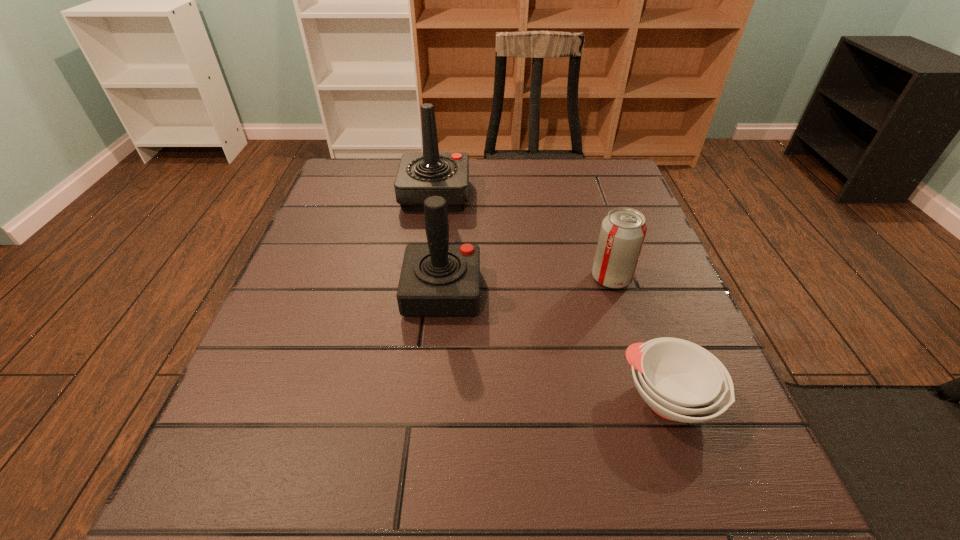
Find the location of a particular element. vacant space that satisfies the following two spatial constraints: 1. on the base of the nearer joystick; 2. on the back side of the shortest object is located at coordinates (433, 399).

The height and width of the screenshot is (540, 960). What are the coordinates of `free location that satisfies the following two spatial constraints: 1. on the front-facing side of the nearest object; 2. on the right side of the farthest object` in the screenshot? It's located at (407, 399).

Identify the location of vacant position in the image that satisfies the following two spatial constraints: 1. on the front-facing side of the farther joystick; 2. on the back side of the soda can. (423, 278).

The image size is (960, 540). Identify the location of vacant position in the image that satisfies the following two spatial constraints: 1. on the back side of the third tallest object; 2. on the front-facing side of the farther joystick. (585, 195).

Locate an element on the screen. The height and width of the screenshot is (540, 960). free region that satisfies the following two spatial constraints: 1. on the front-facing side of the nearest object; 2. on the left side of the farthest object is located at coordinates (407, 399).

You are a GUI agent. You are given a task and a screenshot of the screen. Output one action in this format:
    pyautogui.click(x=<x>, y=<y>)
    Task: Click on the free space that satisfies the following two spatial constraints: 1. on the back side of the third tallest object; 2. on the front-facing side of the farther joystick
    The image size is (960, 540).
    Given the screenshot: What is the action you would take?
    pyautogui.click(x=585, y=195)

The image size is (960, 540). What are the coordinates of `free space in the image that satisfies the following two spatial constraints: 1. on the front-facing side of the farther joystick; 2. on the right side of the nearest object` in the screenshot? It's located at (407, 399).